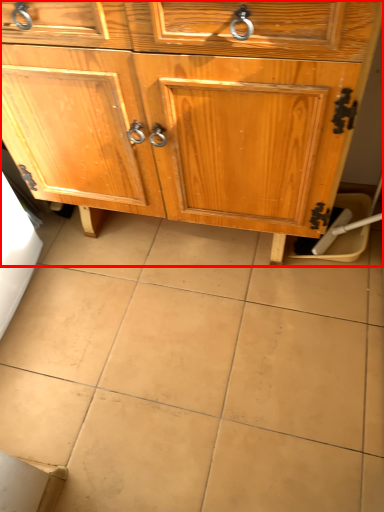
Question: From the image's perspective, where is chest of drawers (annotated by the red box) located relative to ceramic tile?

Choices:
 (A) above
 (B) below

Answer: (A)